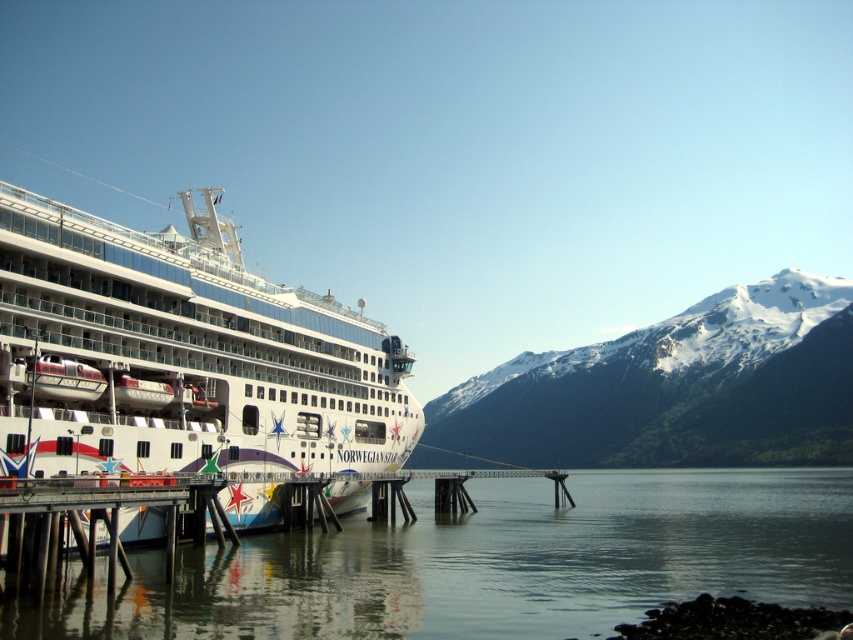
You are a photographer planning to capture the Norwegian Star cruise ship and the surrounding water. Based on the scene, which object occupies a larger area in the image? Please choose between the clear water at lower left and the white glossy cruise ship at left.

The clear water at lower left is larger in size than the white glossy cruise ship at left, so the clear water at lower left occupies a larger area in the image.

You are standing on the cruise ship Norwegian Star and want to take a photo of the point at coordinates (815, 477). If the camera you are using has a maximum range of 200 meters, will you be able to capture the point in your photo?

The point at coordinates (815, 477) is 187.12 meters away from the camera. Since the camera has a maximum range of 200 meters, you will be able to capture the point in your photo.

You are a photographer planning to capture the Norwegian Star cruise ship and the snowy mountains in one shot. Given that your camera can only focus on objects within a 100m width, and the distance between the white glossy cruise ship at left and the snowy rocky mountain at right is 80 meters, will both fit in the frame?

The distance between the white glossy cruise ship at left and the snowy rocky mountain at right is 80 meters, which is within the camera focus range of 100 meters. Therefore, both will fit in the frame.